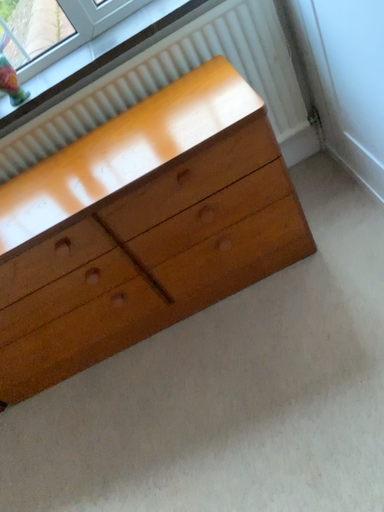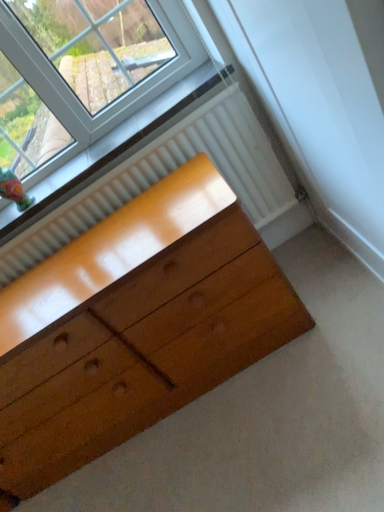
Question: Which way did the camera rotate in the video?

Choices:
 (A) rotated upward
 (B) rotated downward

Answer: (A)